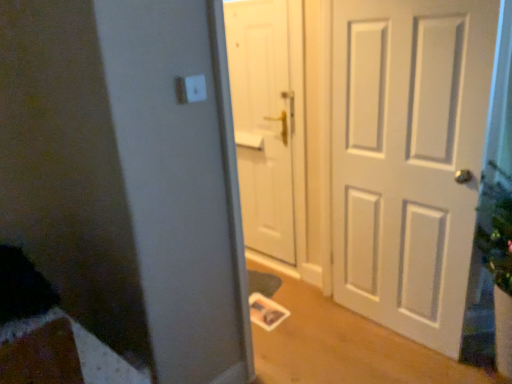
Question: Does white matte door at center, which is the 1th door in left-to-right order, come behind white plastic light switch at upper center?

Choices:
 (A) no
 (B) yes

Answer: (B)

Question: Can you confirm if white matte door at center, the 2th door from the right, is bigger than white plastic light switch at upper center?

Choices:
 (A) yes
 (B) no

Answer: (A)

Question: Is white matte door at center, the 2th door from the right, facing towards white plastic light switch at upper center?

Choices:
 (A) no
 (B) yes

Answer: (A)

Question: Is white matte door at center, which is the 1th door in left-to-right order, shorter than white plastic light switch at upper center?

Choices:
 (A) yes
 (B) no

Answer: (B)

Question: From the image's perspective, is white matte door at center, the 2th door from the right, located beneath white plastic light switch at upper center?

Choices:
 (A) yes
 (B) no

Answer: (A)

Question: Is white matte door at center, the 2th door from the right, positioned beyond the bounds of white plastic light switch at upper center?

Choices:
 (A) yes
 (B) no

Answer: (A)

Question: Is white plastic light switch at upper center at the left side of white matte door at right, the 2th door from the left?

Choices:
 (A) yes
 (B) no

Answer: (A)

Question: From a real-world perspective, is white plastic light switch at upper center located higher than white matte door at right, the first door positioned from the right?

Choices:
 (A) no
 (B) yes

Answer: (B)

Question: Is white plastic light switch at upper center positioned behind white matte door at right, the first door positioned from the right?

Choices:
 (A) yes
 (B) no

Answer: (B)

Question: From a real-world perspective, is white plastic light switch at upper center beneath white matte door at right, the first door positioned from the right?

Choices:
 (A) no
 (B) yes

Answer: (A)

Question: Is white plastic light switch at upper center placed right next to white matte door at right, the first door positioned from the right?

Choices:
 (A) yes
 (B) no

Answer: (B)

Question: Does white plastic light switch at upper center turn towards white matte door at right, the first door positioned from the right?

Choices:
 (A) no
 (B) yes

Answer: (A)

Question: Is white matte door at right, the 2th door from the left, at the right side of white plastic light switch at upper center?

Choices:
 (A) yes
 (B) no

Answer: (A)